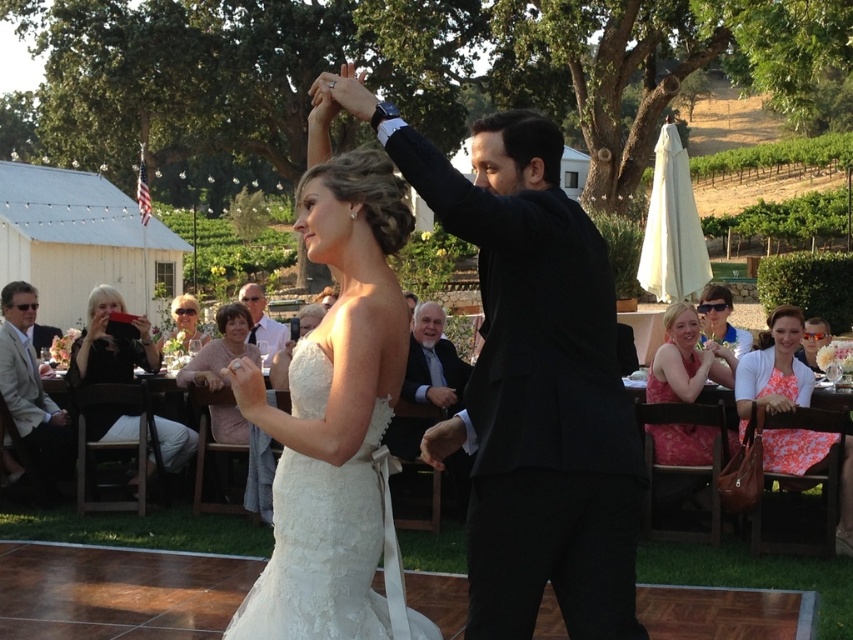
Question: Is white satin dress at center smaller than light brown hair at upper center?

Choices:
 (A) yes
 (B) no

Answer: (A)

Question: In this image, where is pink satin dress at lower right located relative to dark blue suit at center?

Choices:
 (A) left
 (B) right

Answer: (B)

Question: Can you confirm if black fabric camera at left is thinner than pink fabric at center?

Choices:
 (A) yes
 (B) no

Answer: (B)

Question: Which point is farther to the camera?

Choices:
 (A) (653, 456)
 (B) (461, 456)

Answer: (B)

Question: Which object is positioned farthest from the matte pink dress at upper right?

Choices:
 (A) orange floral dress at lower right
 (B) pink fabric at center
 (C) white satin dress at center

Answer: (C)

Question: Which point appears farthest from the camera in this image?

Choices:
 (A) (357, 216)
 (B) (96, 339)

Answer: (B)